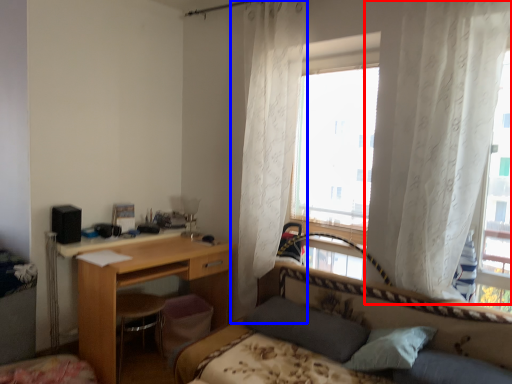
Question: Which object appears farthest to the camera in this image, curtain (highlighted by a red box) or curtain (highlighted by a blue box)?

Choices:
 (A) curtain
 (B) curtain

Answer: (B)